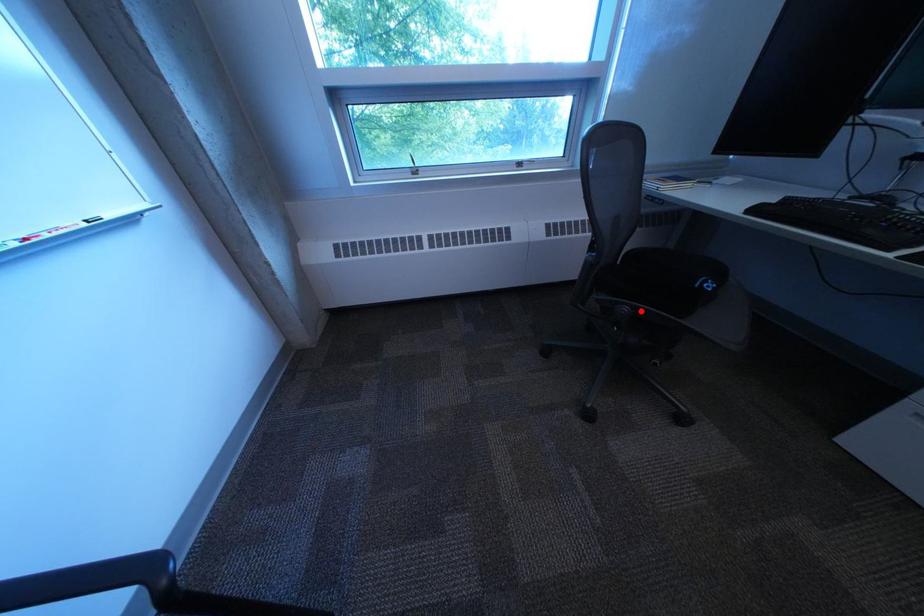
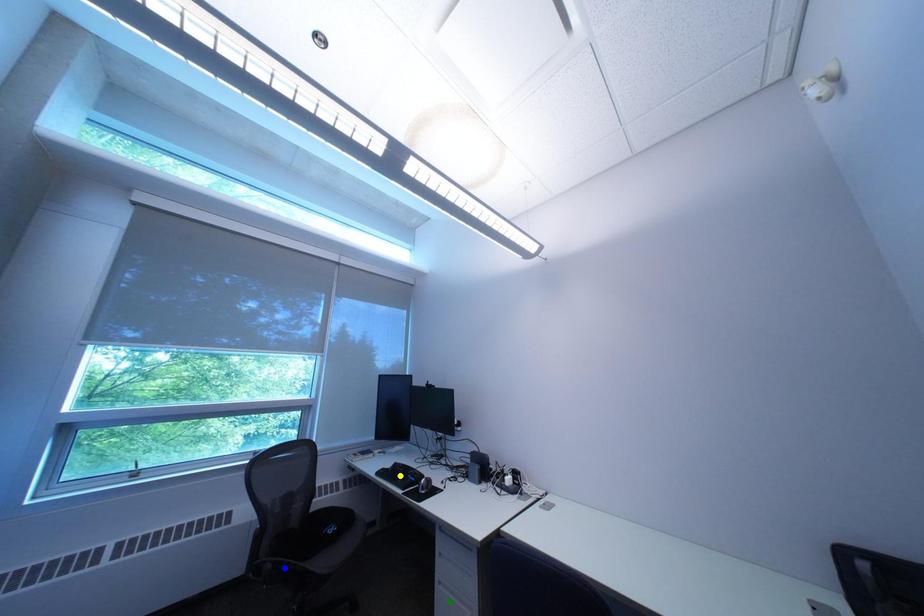
Question: I am providing you with two images of the same scene from different viewpoints. A red point is marked on the first image. You are given multiple points on the second image. Which mark in image 2 goes with the point in image 1?

Choices:
 (A) blue point
 (B) yellow point
 (C) green point

Answer: (A)